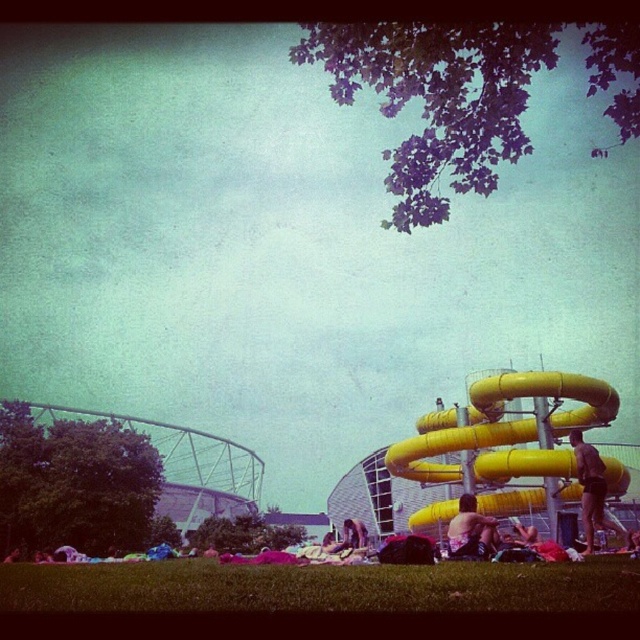
In the scene shown: You are a visitor at the water park and want to know if the green grass at lower center is wider than the smooth yellow slide at right. Can you confirm this?

The green grass at lower center is wider than the smooth yellow slide at right according to the description.

You are a maintenance worker at the water park and need to place a new bench that is 1.2 meters wide. You see the yellow rubber slide at right and the matte black shorts at center. Which object should you place the bench next to if you want it to be wider than the bench?

The yellow rubber slide at right is wider than the matte black shorts at center, so you should place the bench next to the yellow rubber slide at right to ensure it is wider than the bench.

You are a parent trying to decide between two water slides for your child. The yellow rubber slide at right and the smooth yellow slide at right. Which one is taller?

The yellow rubber slide at right is much taller than the smooth yellow slide at right according to the description.